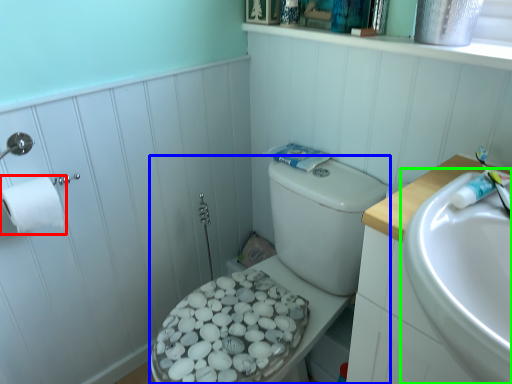
Question: Estimate the real-world distances between objects in this image. Which object is farther from toilet paper (highlighted by a red box), porcelain (highlighted by a blue box) or sink (highlighted by a green box)?

Choices:
 (A) porcelain
 (B) sink

Answer: (B)